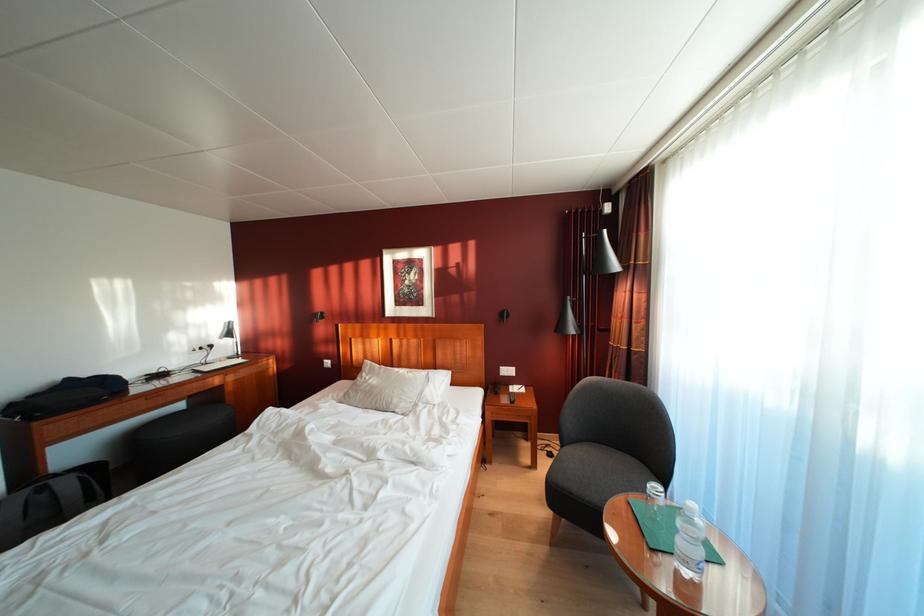
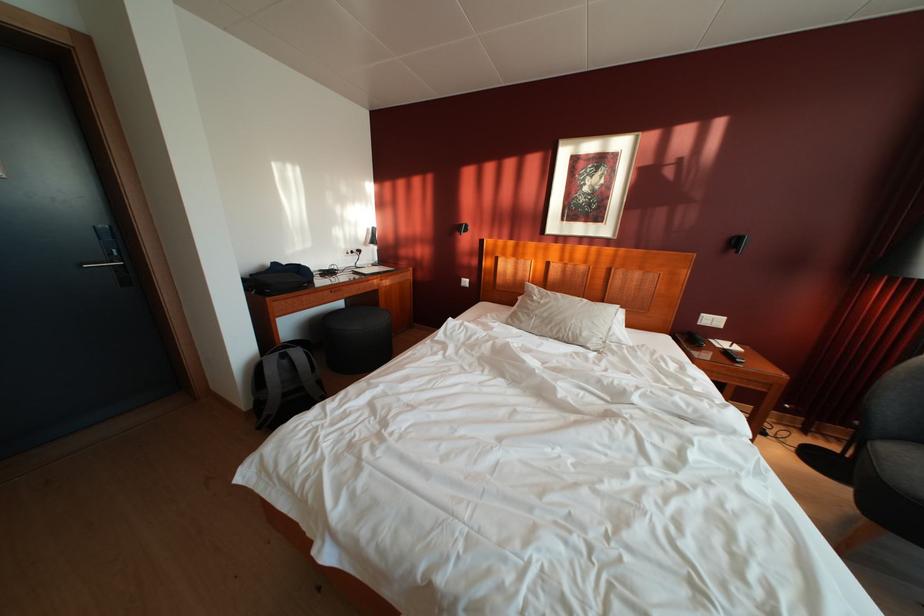
In the second image, find the point that corresponds to (x=403, y=407) in the first image.

(593, 339)